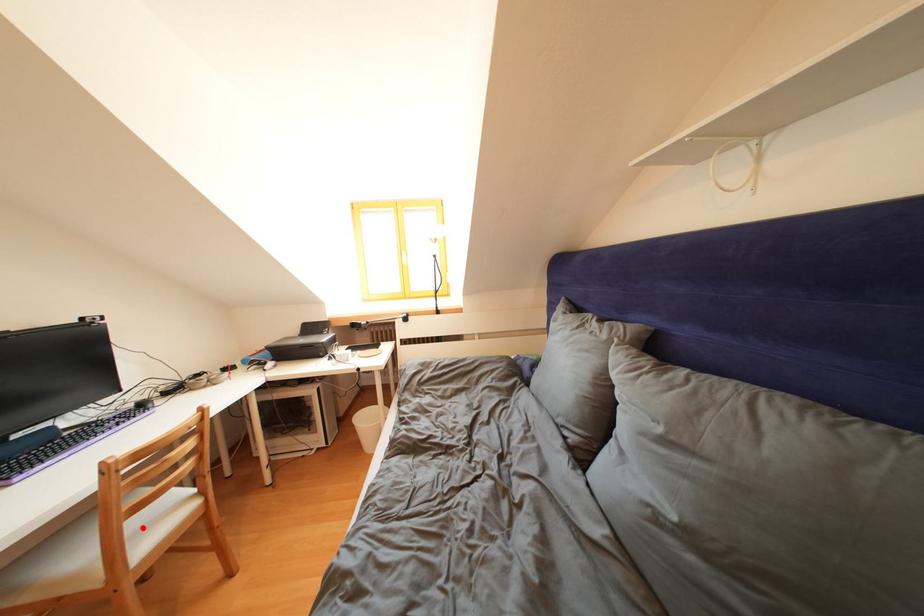
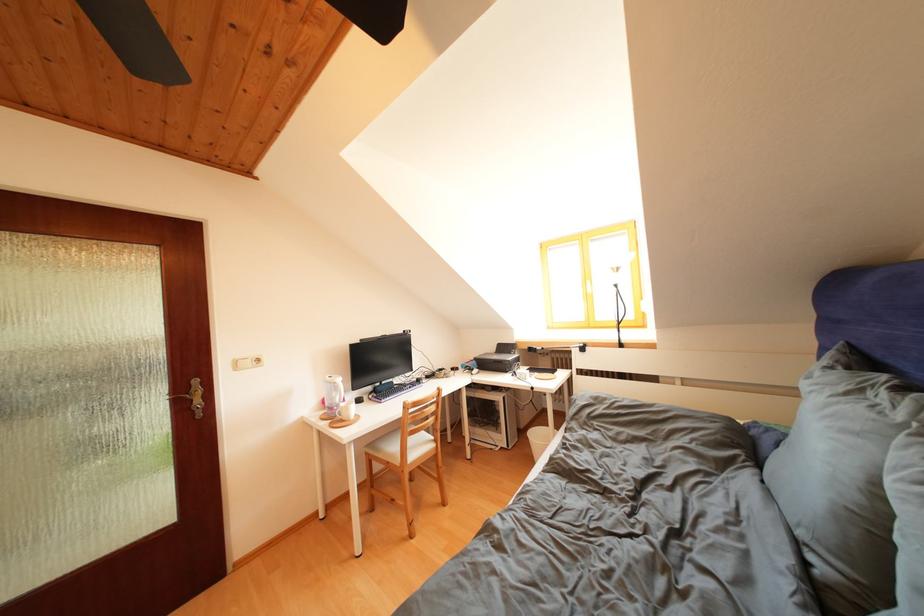
Question: I am providing you with two images of the same scene from different viewpoints. Given a red point in image1, look at the same physical point in image2. Is it:

Choices:
 (A) Closer to the viewpoint
 (B) Farther from the viewpoint

Answer: (B)